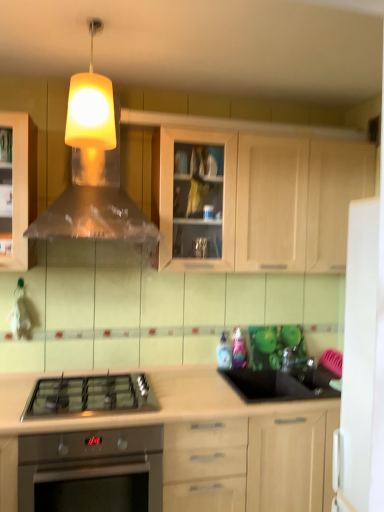
Question: Choose the correct answer: Is satin nickel faucet at right inside metallic silver vent at upper center or outside it?

Choices:
 (A) inside
 (B) outside

Answer: (B)

Question: Is satin nickel faucet at right in front of or behind metallic silver vent at upper center in the image?

Choices:
 (A) front
 (B) behind

Answer: (B)

Question: Which object is positioned farthest from the yellow matte lampshade at upper center?

Choices:
 (A) satin nickel faucet at right
 (B) light wood cabinet at upper center, marked as the 2th cabinetry in a bottom-to-top arrangement
 (C) stainless steel oven at lower left
 (D) light wood cabinet at center, acting as the second cabinetry starting from the top
 (E) metallic silver vent at upper center

Answer: (A)

Question: Estimate the real-world distances between objects in this image. Which object is farther from the light wood cabinet at upper center, marked as the 2th cabinetry in a bottom-to-top arrangement?

Choices:
 (A) yellow matte lampshade at upper center
 (B) light wood cabinet at center, acting as the second cabinetry starting from the top
 (C) satin nickel faucet at right
 (D) stainless steel oven at lower left
 (E) satin black gas stove at center

Answer: (D)